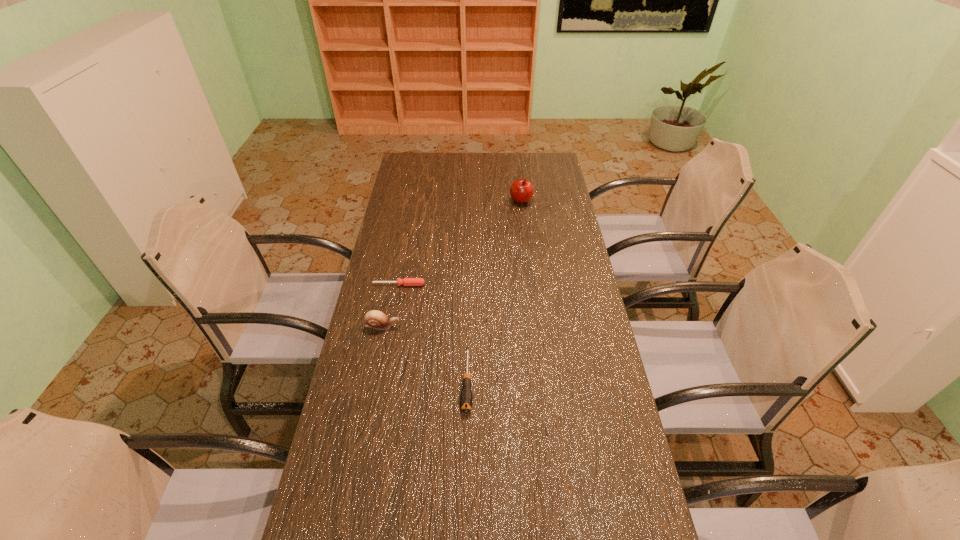
Where is `vacant region located on the back of the third object from left to right`? This screenshot has height=540, width=960. vacant region located on the back of the third object from left to right is located at coordinates (468, 308).

Where is `vacant area situated on the right of the third nearest object`? vacant area situated on the right of the third nearest object is located at coordinates tap(507, 285).

This screenshot has height=540, width=960. Identify the location of escargot that is at the left edge. (375, 319).

This screenshot has height=540, width=960. Identify the location of screwdriver that is at the left edge. (406, 281).

At what (x,y) coordinates should I click in order to perform the action: click on object at the right edge. Please return your answer as a coordinate pair (x, y). This screenshot has width=960, height=540. Looking at the image, I should click on (521, 191).

In the image, there is a desktop. Where is `free space at the far edge`? The height and width of the screenshot is (540, 960). free space at the far edge is located at coordinates (489, 155).

In the image, there is a desktop. Where is `vacant space at the left edge`? This screenshot has width=960, height=540. vacant space at the left edge is located at coordinates (401, 188).

The height and width of the screenshot is (540, 960). Find the location of `vacant space at the right edge of the desktop`. vacant space at the right edge of the desktop is located at coordinates (543, 271).

Find the location of a particular element. The image size is (960, 540). free region at the far left corner of the desktop is located at coordinates (423, 161).

Image resolution: width=960 pixels, height=540 pixels. I want to click on blank space at the far right corner of the desktop, so click(540, 157).